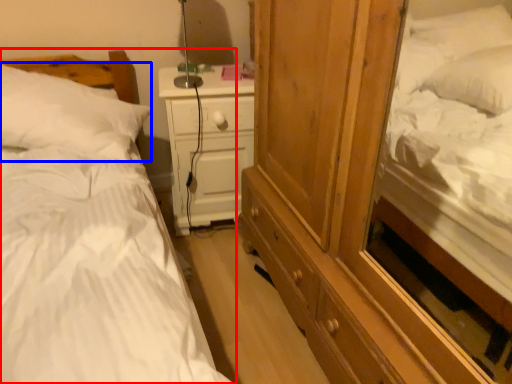
Question: Among these objects, which one is farthest to the camera, bed (highlighted by a red box) or pillow (highlighted by a blue box)?

Choices:
 (A) bed
 (B) pillow

Answer: (B)